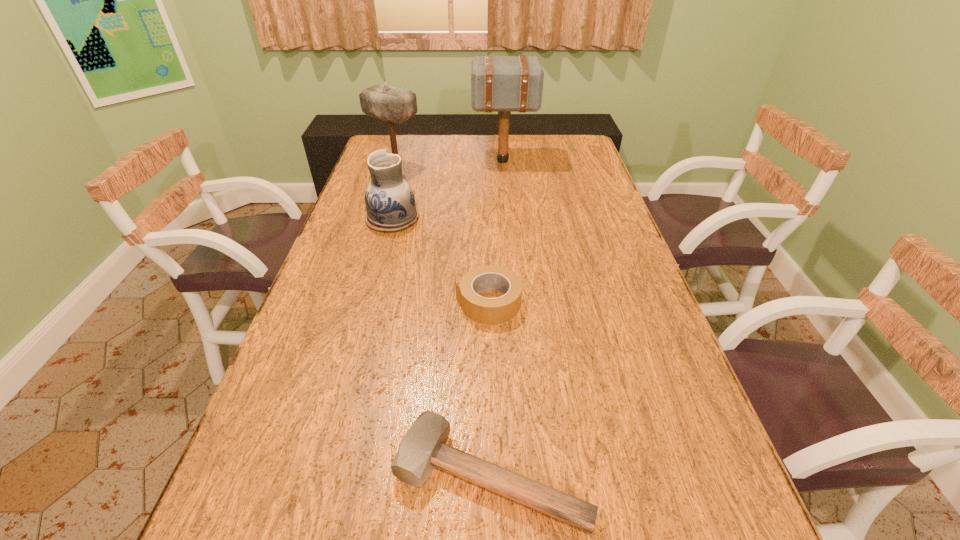
At what (x,y) coordinates should I click in order to perform the action: click on the leftmost mallet. Please return your answer as a coordinate pair (x, y). The height and width of the screenshot is (540, 960). Looking at the image, I should click on (395, 105).

Locate an element on the screen. the third nearest object is located at coordinates (390, 203).

Locate an element on the screen. The width and height of the screenshot is (960, 540). the third shortest object is located at coordinates (x=390, y=203).

You are a GUI agent. You are given a task and a screenshot of the screen. Output one action in this format:
    pyautogui.click(x=<x>, y=<y>)
    Task: Click on the duct tape
    
    Given the screenshot: What is the action you would take?
    pos(484,310)

Image resolution: width=960 pixels, height=540 pixels. In order to click on the nearest mallet in this screenshot , I will do `click(423, 447)`.

This screenshot has height=540, width=960. What are the coordinates of `the nearest object` in the screenshot? It's located at (423, 447).

The image size is (960, 540). Identify the location of vacant area situated on the front of the leftmost mallet. (380, 222).

Where is `vacant area situated 0.330m on the front of the pottery`? The width and height of the screenshot is (960, 540). vacant area situated 0.330m on the front of the pottery is located at coordinates (368, 312).

Where is `vacant space located at the edge of the duct tape`? This screenshot has height=540, width=960. vacant space located at the edge of the duct tape is located at coordinates (389, 302).

Locate an element on the screen. The width and height of the screenshot is (960, 540). vacant space positioned 0.140m at the edge of the duct tape is located at coordinates (400, 302).